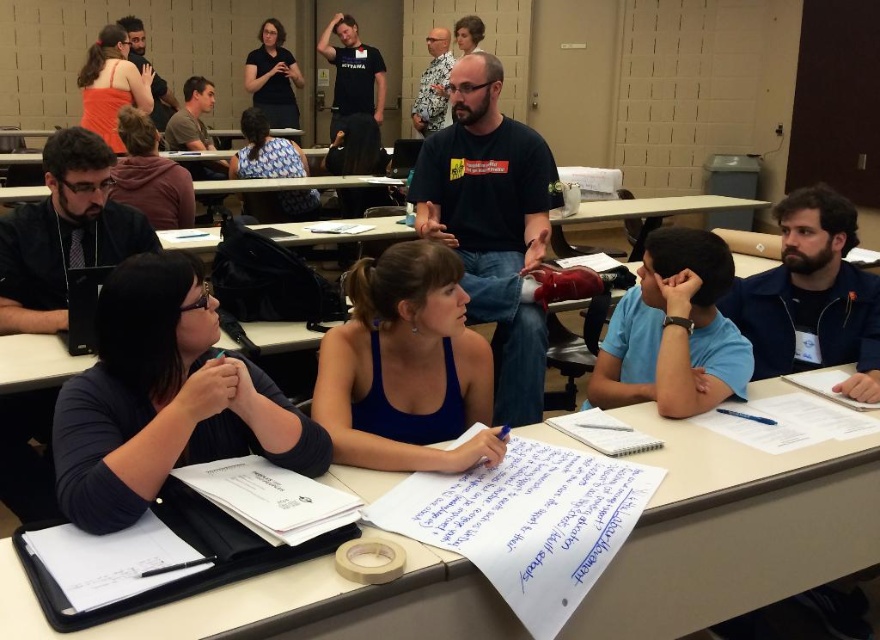
Question: Can you confirm if dark blue shirt at left is wider than blue tank top at center?

Choices:
 (A) yes
 (B) no

Answer: (A)

Question: Based on their relative distances, which object is nearer to the blue tank top at center?

Choices:
 (A) white paper at lower left
 (B) white paper at center

Answer: (B)

Question: Considering the real-world distances, which object is closest to the white paper at lower left?

Choices:
 (A) white paper at center
 (B) dark blue shirt at left

Answer: (B)

Question: Can you confirm if white paper at center is bigger than dark blue shirt at left?

Choices:
 (A) no
 (B) yes

Answer: (B)

Question: Is the position of dark blue shirt at left more distant than that of white paper at lower left?

Choices:
 (A) no
 (B) yes

Answer: (A)

Question: Estimate the real-world distances between objects in this image. Which object is farther from the white paper at lower left?

Choices:
 (A) dark blue shirt at left
 (B) blue tank top at center

Answer: (B)